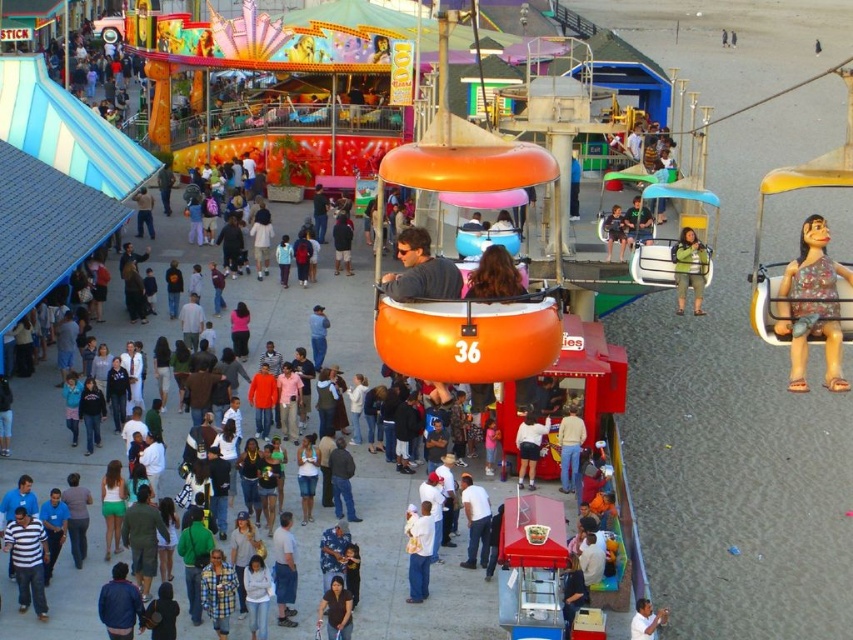
Who is taller, white cotton shirt at center or denim jacket at center?

white cotton shirt at center is taller.

Measure the distance from white cotton shirt at center to denim jacket at center.

The distance of white cotton shirt at center from denim jacket at center is 2.42 meters.

Locate an element on the screen. The image size is (853, 640). white cotton shirt at center is located at coordinates [x=419, y=552].

Does floral fabric doll at right come behind matte gray shirt at center?

Yes, it is.

The height and width of the screenshot is (640, 853). What do you see at coordinates (811, 305) in the screenshot?
I see `floral fabric doll at right` at bounding box center [811, 305].

Is point (834, 266) positioned in front of point (399, 253)?

Yes, point (834, 266) is closer to viewer.

At what (x,y) coordinates should I click in order to perform the action: click on floral fabric doll at right. Please return your answer as a coordinate pair (x, y). This screenshot has height=640, width=853. Looking at the image, I should click on (811, 305).

Which is below, green fabric dress at center or matte black shorts at center?

matte black shorts at center is below.

Is point (706, 266) behind point (531, 429)?

No, (706, 266) is closer to viewer.

In order to click on green fabric dress at center in this screenshot , I will do `click(689, 268)`.

Locate an element on the screen. The height and width of the screenshot is (640, 853). green fabric dress at center is located at coordinates (689, 268).